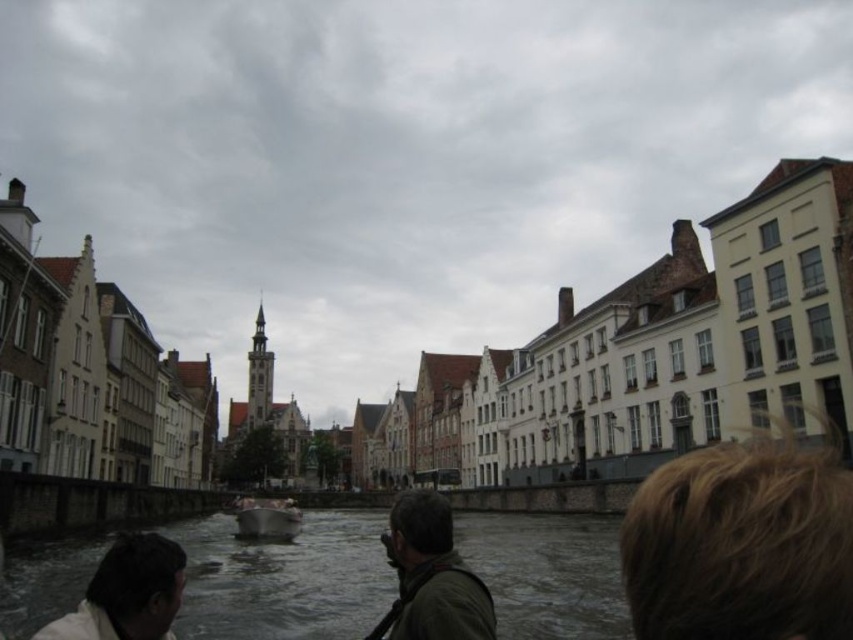
Does dark green fabric at center come behind metallic gray boat at center?

No, it is not.

Is dark green fabric at center smaller than metallic gray boat at center?

Incorrect, dark green fabric at center is not smaller in size than metallic gray boat at center.

The image size is (853, 640). What are the coordinates of `dark green fabric at center` in the screenshot? It's located at [431, 576].

Does gray water at center appear on the left side of dark green fabric at center?

Correct, you'll find gray water at center to the left of dark green fabric at center.

Who is lower down, gray water at center or dark green fabric at center?

dark green fabric at center is lower down.

Image resolution: width=853 pixels, height=640 pixels. Find the location of `gray water at center`. gray water at center is located at coordinates (283, 579).

Is point (733, 618) less distant than point (258, 532)?

Yes, point (733, 618) is closer to viewer.

Measure the distance between blonde hair at upper right and camera.

The distance of blonde hair at upper right from camera is 30.58 meters.

Find the location of a particular element. This screenshot has width=853, height=640. blonde hair at upper right is located at coordinates (741, 544).